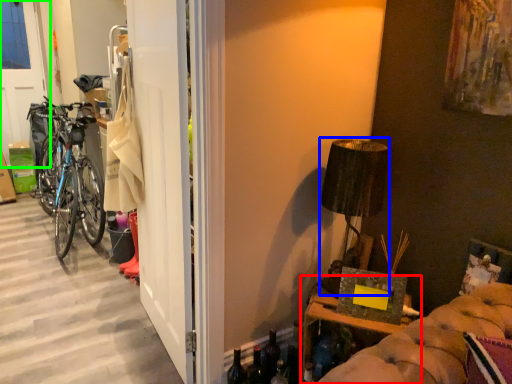
Question: Based on their relative distances, which object is nearer to furniture (highlighted by a red box)? Choose from lamp (highlighted by a blue box) and screen door (highlighted by a green box).

Choices:
 (A) lamp
 (B) screen door

Answer: (A)